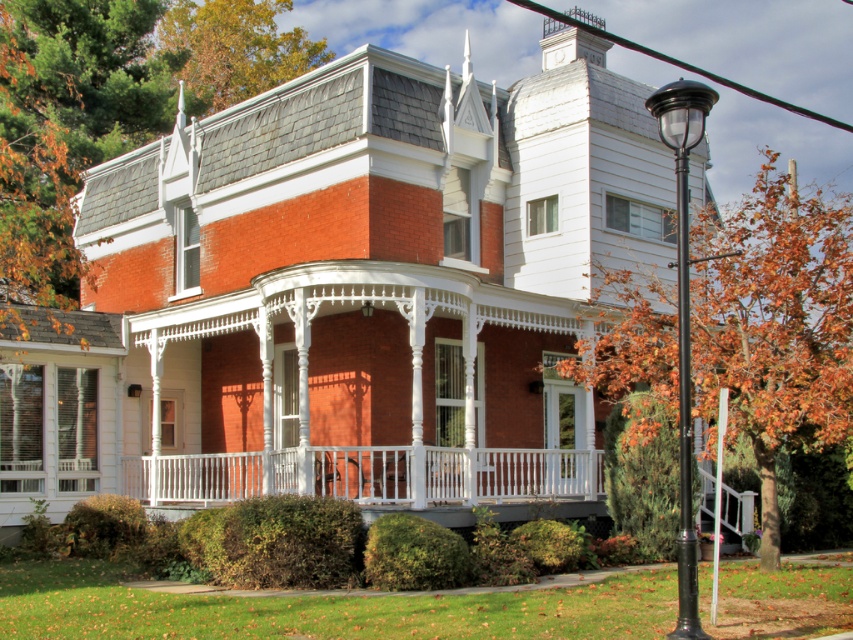
You are standing at the front door of the Victorian house and want to walk to the wooden bench on the porch. You notice two points marked on the porch floor. One is at point coordinates point [236,467] and the other is at point coordinates point [693,632]. Which point is closer to you as you face the front door?

Point [236,467] is behind point [693,632]. Therefore, when facing the front door, point [693,632] is closer to you since it is in front of point [236,467].